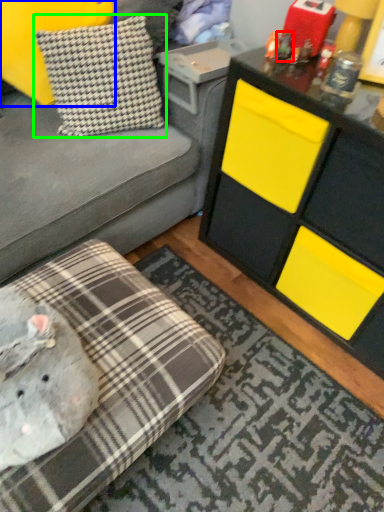
Question: Which object is positioned closest to toy (highlighted by a red box)? Select from pillow (highlighted by a blue box) and pillow (highlighted by a green box).

Choices:
 (A) pillow
 (B) pillow

Answer: (B)